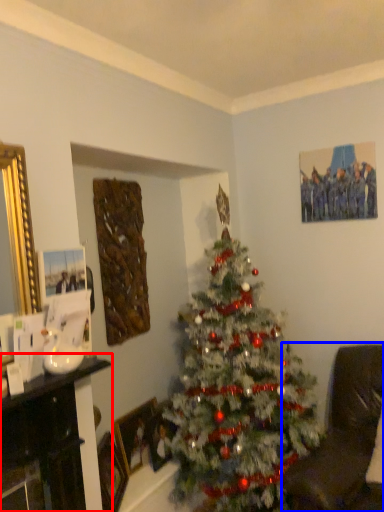
Question: Which point is closer to the camera, furniture (highlighted by a red box) or rocking chair (highlighted by a blue box)?

Choices:
 (A) furniture
 (B) rocking chair

Answer: (B)